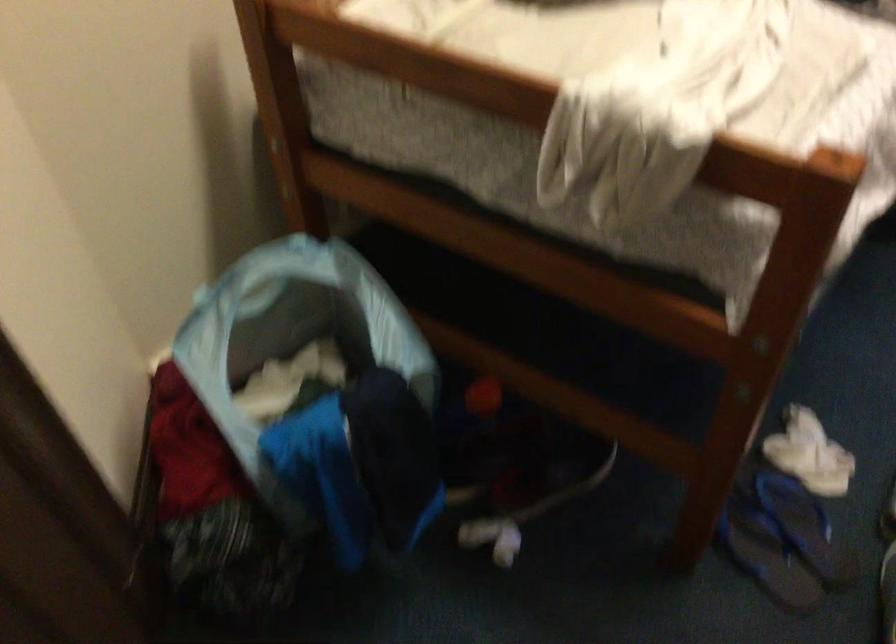
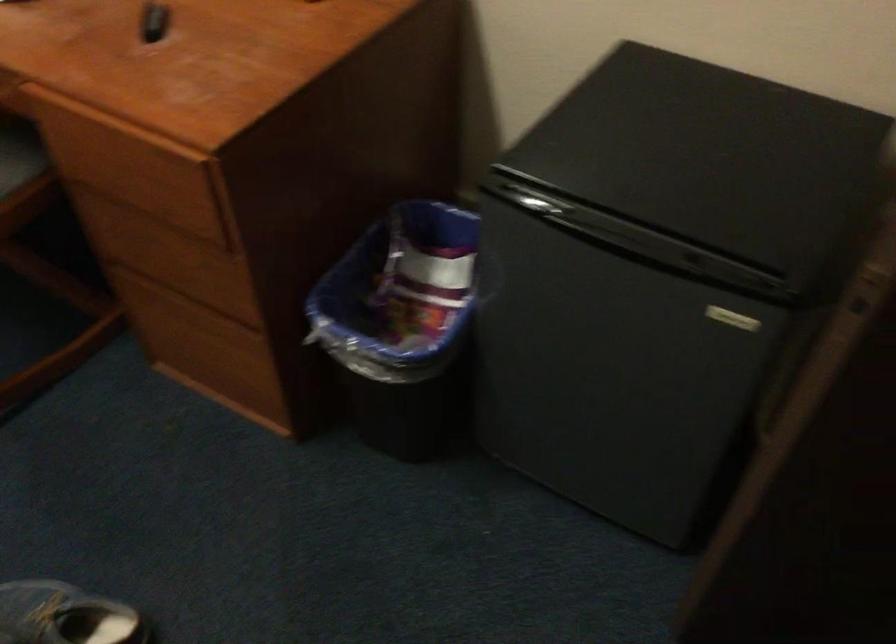
Looking at this image, how did the camera likely rotate?

The rotation direction of the camera is right-down.